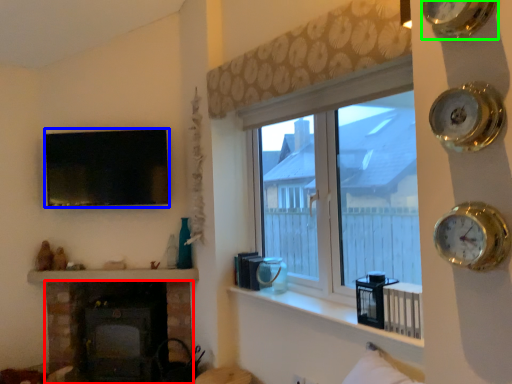
Question: Considering the real-world distances, which object is farthest from wood burning stove (highlighted by a red box)? picture frame (highlighted by a blue box) or clock (highlighted by a green box)?

Choices:
 (A) picture frame
 (B) clock

Answer: (B)